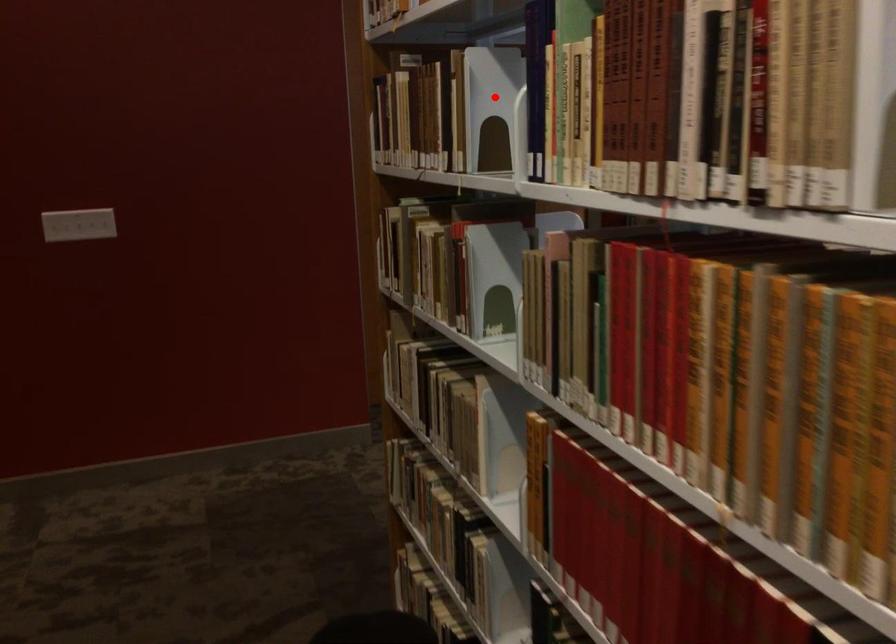
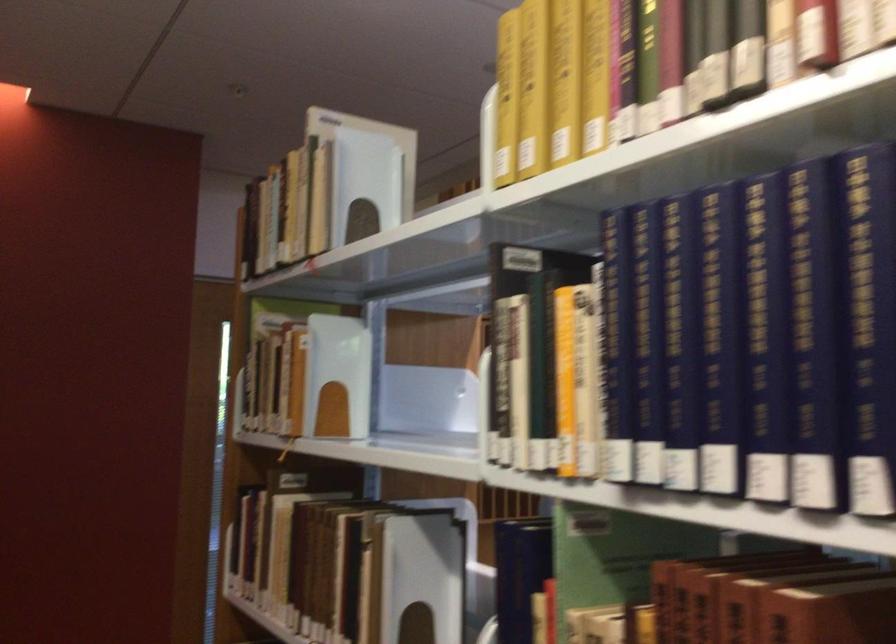
The point at the highlighted location is marked in the first image. Where is the corresponding point in the second image?

(417, 581)